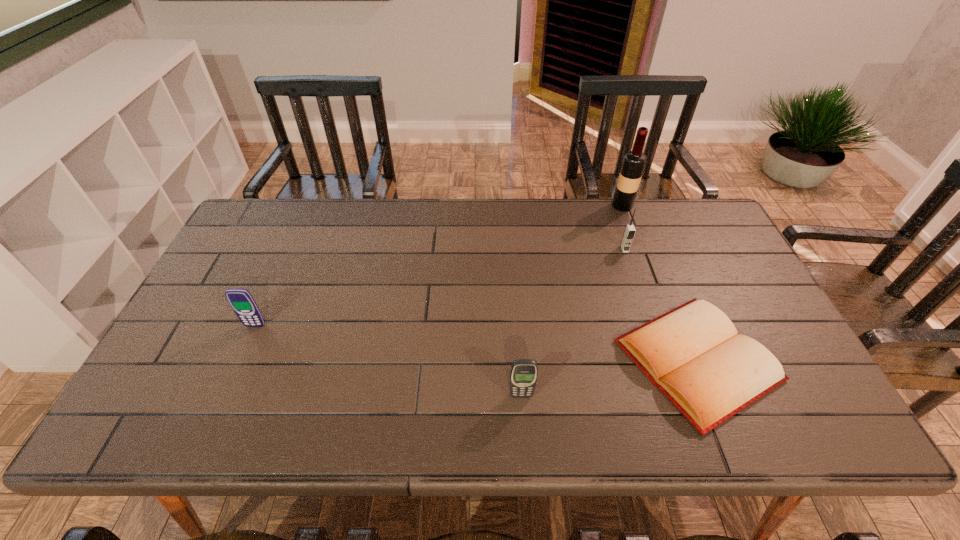
This screenshot has width=960, height=540. Find the location of `vacant space in between the Bible and the second farthest object`. vacant space in between the Bible and the second farthest object is located at coordinates (660, 305).

Find the location of a particular element. free space between the rightmost cellular telephone and the farthest object is located at coordinates (623, 227).

Locate an element on the screen. The width and height of the screenshot is (960, 540). vacant space in between the Bible and the fourth object from right to left is located at coordinates (610, 378).

Locate an element on the screen. The width and height of the screenshot is (960, 540). free space between the shortest object and the second farthest object is located at coordinates (660, 305).

Find the location of a particular element. This screenshot has height=540, width=960. object that stands as the closest to the leftmost cellular telephone is located at coordinates (523, 376).

Select which object appears as the second closest to the leftmost object. Please provide its 2D coordinates. Your answer should be formatted as a tuple, i.e. [(x, y)], where the tuple contains the x and y coordinates of a point satisfying the conditions above.

[(693, 354)]

Point out which cellular telephone is positioned as the nearest to the leftmost object. Please provide its 2D coordinates. Your answer should be formatted as a tuple, i.e. [(x, y)], where the tuple contains the x and y coordinates of a point satisfying the conditions above.

[(523, 376)]

Locate which cellular telephone ranks third in proximity to the wine bottle. Please provide its 2D coordinates. Your answer should be formatted as a tuple, i.e. [(x, y)], where the tuple contains the x and y coordinates of a point satisfying the conditions above.

[(241, 301)]

The height and width of the screenshot is (540, 960). What are the coordinates of `free location that satisfies the following two spatial constraints: 1. on the front-facing side of the fourth nearest object; 2. on the left side of the shortest object` in the screenshot? It's located at (662, 360).

Find the location of `free point that satisfies the following two spatial constraints: 1. on the front-facing side of the Bible; 2. on the right side of the second farthest cellular telephone`. free point that satisfies the following two spatial constraints: 1. on the front-facing side of the Bible; 2. on the right side of the second farthest cellular telephone is located at coordinates (240, 360).